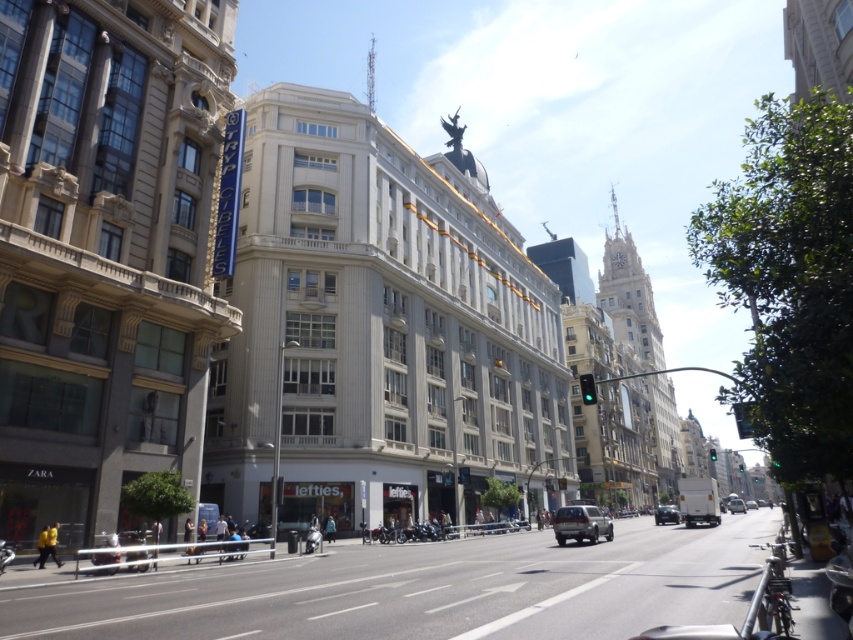
Is silver metallic suv at center thinner than metallic silver car at center?

Indeed, silver metallic suv at center has a lesser width compared to metallic silver car at center.

Does point (589, 528) come farther from viewer compared to point (657, 508)?

No, it is in front of (657, 508).

Does point (572, 524) come behind point (662, 513)?

No.

At what (x,y) coordinates should I click in order to perform the action: click on silver metallic suv at center. Please return your answer as a coordinate pair (x, y). Looking at the image, I should click on 579,524.

Does metallic silver car at center have a greater width compared to silver metallic van at center?

Yes, metallic silver car at center is wider than silver metallic van at center.

Is metallic silver car at center to the right of silver metallic van at center from the viewer's perspective?

In fact, metallic silver car at center is to the left of silver metallic van at center.

Identify the location of metallic silver car at center. The height and width of the screenshot is (640, 853). (666, 515).

Where is `metallic silver car at center`? The image size is (853, 640). metallic silver car at center is located at coordinates (666, 515).

Between silver metallic suv at center and silver metallic van at center, which one is positioned higher?

Positioned higher is silver metallic suv at center.

Who is taller, silver metallic suv at center or silver metallic van at center?

silver metallic suv at center

Who is more distant from viewer, (608, 524) or (730, 513)?

The point (730, 513) is more distant.

The image size is (853, 640). In order to click on silver metallic suv at center in this screenshot , I will do `click(579, 524)`.